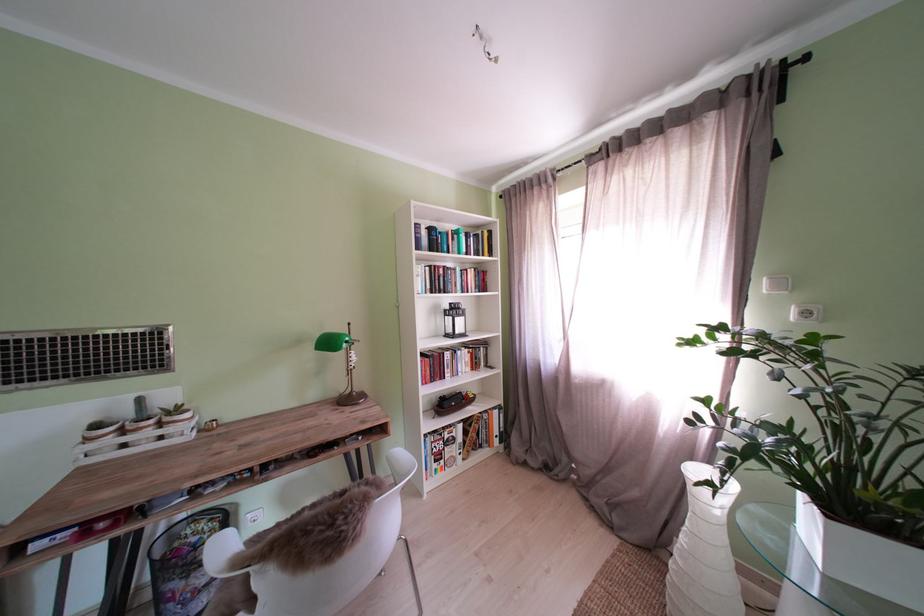
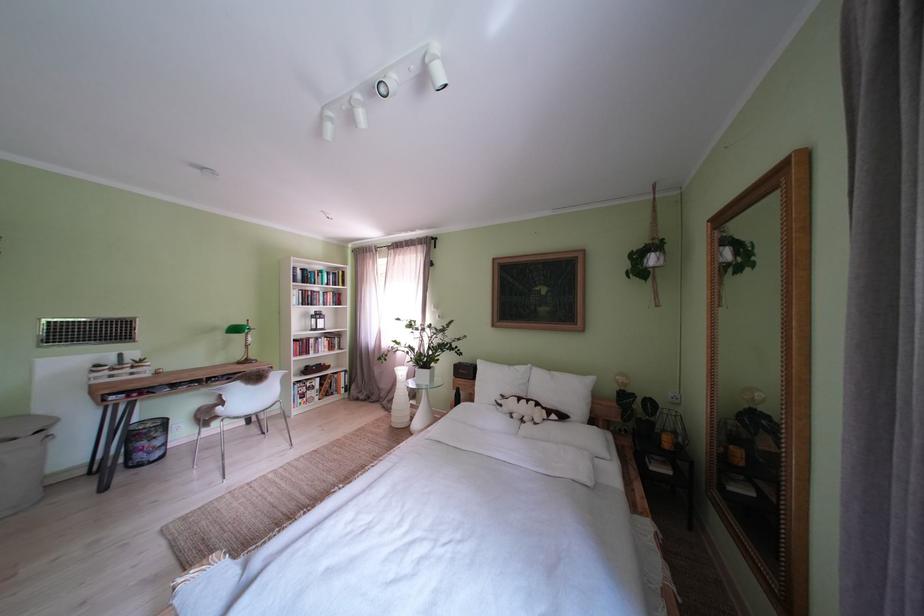
Question: Which direction would the cameraman need to move to produce the second image? Reply with the corresponding letter.

Choices:
 (A) Left
 (B) Right
 (C) Forward
 (D) Backward

Answer: (D)